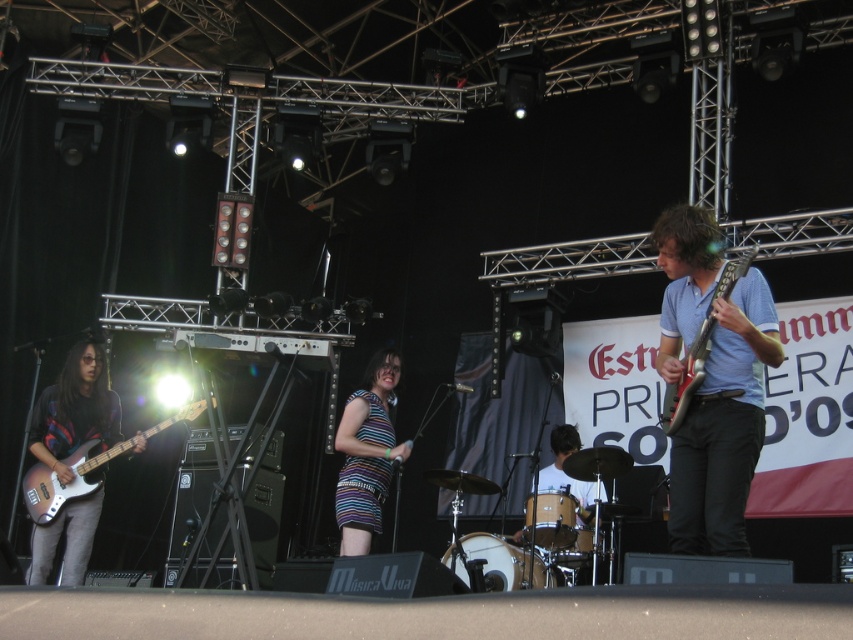
Can you confirm if brushed metal bass guitar at left is thinner than striped fabric dress at center?

Incorrect, brushed metal bass guitar at left's width is not less than striped fabric dress at center's.

In the scene shown: Who is more distant from viewer, (x=103, y=412) or (x=357, y=483)?

Point (x=103, y=412)

Identify the location of brushed metal bass guitar at left. (74, 410).

Does brushed metal bass guitar at left appear on the right side of metallic purple bass at left?

In fact, brushed metal bass guitar at left is to the left of metallic purple bass at left.

Is point (90, 388) behind point (102, 474)?

Yes.

Where is `brushed metal bass guitar at left`? brushed metal bass guitar at left is located at coordinates (74, 410).

Does point (68, 355) come farther from viewer compared to point (709, 323)?

Yes.

Does brushed metal bass guitar at left have a greater height compared to matte black electric guitar at right?

Correct, brushed metal bass guitar at left is much taller as matte black electric guitar at right.

Where is `brushed metal bass guitar at left`? The height and width of the screenshot is (640, 853). brushed metal bass guitar at left is located at coordinates (74, 410).